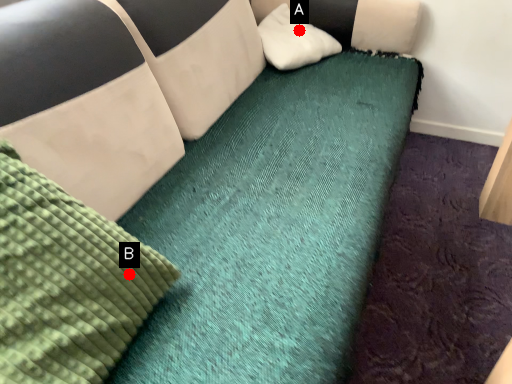
Question: Two points are circled on the image, labeled by A and B beside each circle. Which point is farther from the camera taking this photo?

Choices:
 (A) A is further
 (B) B is further

Answer: (A)